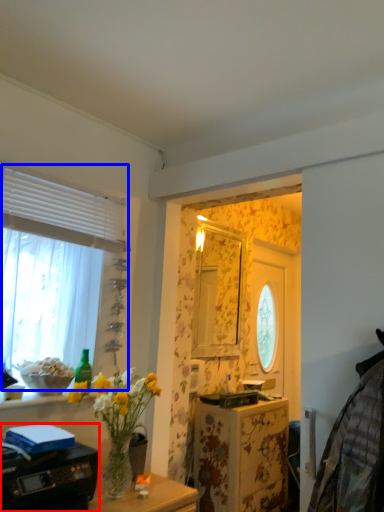
Question: Which object appears farthest to the camera in this image, printer (highlighted by a red box) or window (highlighted by a blue box)?

Choices:
 (A) printer
 (B) window

Answer: (B)